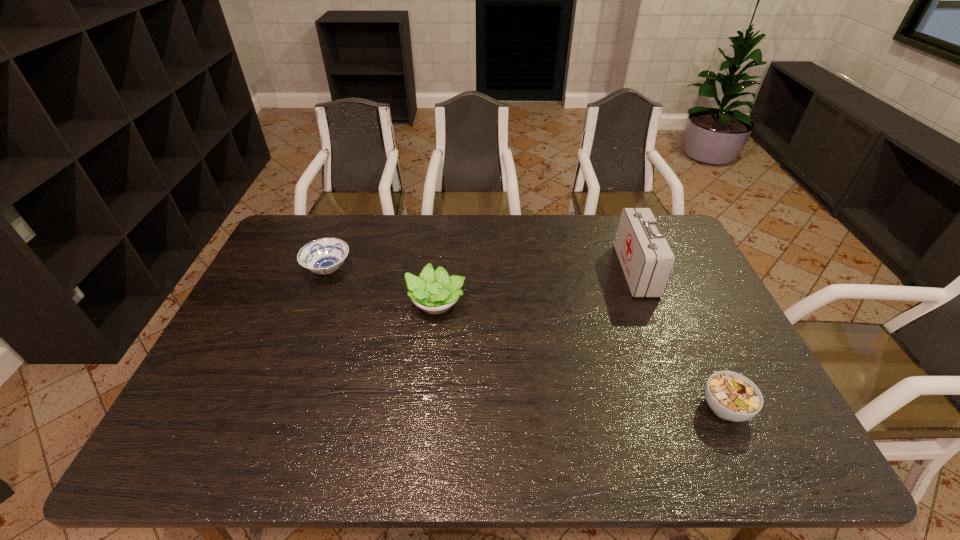
Find the location of a particular element. This screenshot has height=540, width=960. free space that is in between the lettuce and the first-aid kit is located at coordinates (536, 287).

Find the location of a particular element. The image size is (960, 540). free spot between the farther soup bowl and the right soup bowl is located at coordinates (526, 339).

This screenshot has height=540, width=960. In order to click on empty space between the tallest object and the right soup bowl in this screenshot , I will do `click(681, 339)`.

At what (x,y) coordinates should I click in order to perform the action: click on unoccupied position between the farther soup bowl and the tallest object. Please return your answer as a coordinate pair (x, y). Looking at the image, I should click on (482, 270).

You are a GUI agent. You are given a task and a screenshot of the screen. Output one action in this format:
    pyautogui.click(x=<x>, y=<y>)
    Task: Click on the vacant space that's between the first-aid kit and the lettuce
    The image size is (960, 540).
    Given the screenshot: What is the action you would take?
    pyautogui.click(x=536, y=287)

Where is `blank region between the leftmost object and the tallest object`? blank region between the leftmost object and the tallest object is located at coordinates (482, 270).

Identify the location of vacant point located between the leftmost object and the tallest object. (482, 270).

Locate an element on the screen. Image resolution: width=960 pixels, height=540 pixels. free space between the nearest object and the second object from left to right is located at coordinates (580, 355).

You are a GUI agent. You are given a task and a screenshot of the screen. Output one action in this format:
    pyautogui.click(x=<x>, y=<y>)
    Task: Click on the object that is the third closest to the leftmost object
    
    Given the screenshot: What is the action you would take?
    pyautogui.click(x=731, y=396)

Point out which object is positioned as the second nearest to the left soup bowl. Please provide its 2D coordinates. Your answer should be formatted as a tuple, i.e. [(x, y)], where the tuple contains the x and y coordinates of a point satisfying the conditions above.

[(647, 260)]